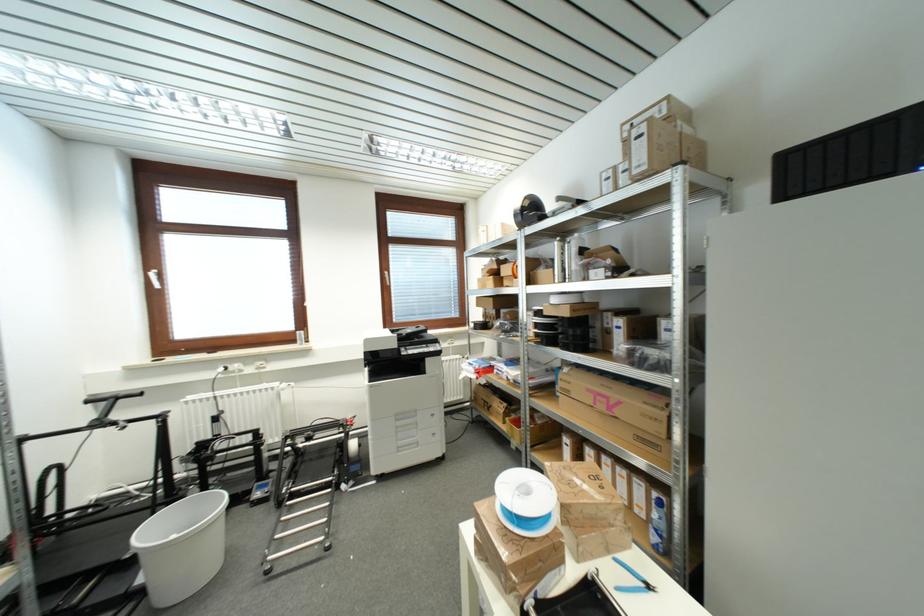
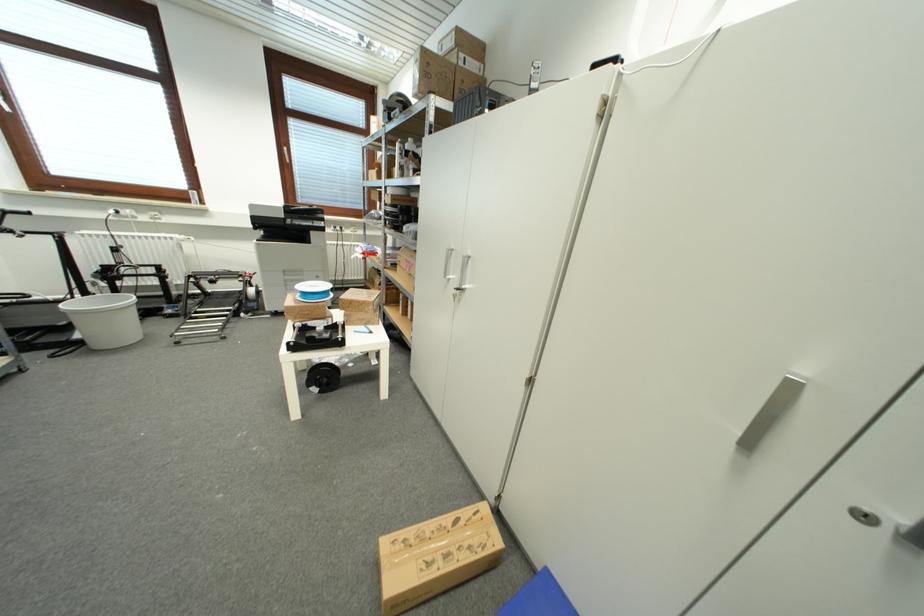
Which direction would the cameraman need to move to produce the second image?

The cameraman moved toward right, backward.